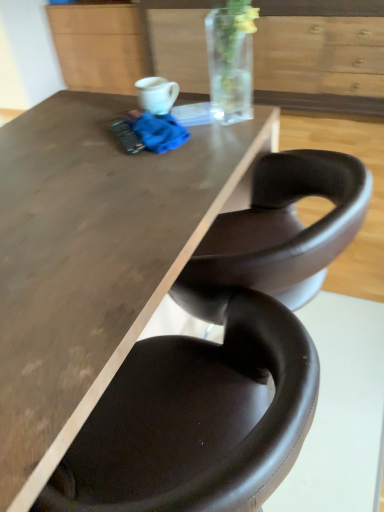
Describe the element at coordinates (157, 94) in the screenshot. I see `white glossy mug at upper center` at that location.

Image resolution: width=384 pixels, height=512 pixels. What do you see at coordinates (91, 260) in the screenshot?
I see `matte brown table at center` at bounding box center [91, 260].

Where is `wooden drawer at upper center`? Image resolution: width=384 pixels, height=512 pixels. wooden drawer at upper center is located at coordinates (320, 55).

How different are the orientations of matte wood cabinet at upper center and wooden drawer at upper center in degrees?

matte wood cabinet at upper center and wooden drawer at upper center are facing 1.2 degrees away from each other.

You are a GUI agent. You are given a task and a screenshot of the screen. Output one action in this format:
    pyautogui.click(x=<x>, y=<y>)
    Task: Click on the drawer below the matte wood cabinet at upper center (from the image's perspective)
    
    Given the screenshot: What is the action you would take?
    pyautogui.click(x=320, y=55)

From a real-world perspective, relative to wooden drawer at upper center, is matte wood cabinet at upper center vertically above or below?

matte wood cabinet at upper center is below wooden drawer at upper center.

Does matte wood cabinet at upper center have a smaller size compared to wooden drawer at upper center?

Yes.

Does brown leather chair at lower center touch matte wood cabinet at upper center?

brown leather chair at lower center and matte wood cabinet at upper center are not in contact.

Is brown leather chair at lower center surrounding matte wood cabinet at upper center?

No, matte wood cabinet at upper center is located outside of brown leather chair at lower center.

Is brown leather chair at lower center facing away from matte wood cabinet at upper center?

No, brown leather chair at lower center's orientation is not away from matte wood cabinet at upper center.

Is the depth of brown leather chair at lower center greater than that of matte wood cabinet at upper center?

No, brown leather chair at lower center is in front of matte wood cabinet at upper center.

Does white glossy mug at upper center have a lesser height compared to matte brown table at center?

Yes, white glossy mug at upper center is shorter than matte brown table at center.

Considering the positions of points (168, 100) and (14, 411), is point (168, 100) closer to camera compared to point (14, 411)?

No, (168, 100) is further to viewer.

How much distance is there between white glossy mug at upper center and matte brown table at center?

A distance of 15.83 inches exists between white glossy mug at upper center and matte brown table at center.

Visually, is white glossy mug at upper center positioned to the left or to the right of wooden drawer at upper center?

In the image, white glossy mug at upper center appears on the left side of wooden drawer at upper center.

Can you confirm if white glossy mug at upper center is bigger than wooden drawer at upper center?

Actually, white glossy mug at upper center might be smaller than wooden drawer at upper center.

Is the depth of white glossy mug at upper center greater than that of wooden drawer at upper center?

No, white glossy mug at upper center is in front of wooden drawer at upper center.

From a real-world perspective, is white glossy mug at upper center above or below wooden drawer at upper center?

Clearly, from a real-world perspective, white glossy mug at upper center is above wooden drawer at upper center.

Considering the positions of points (279, 317) and (166, 108), is point (279, 317) farther from camera compared to point (166, 108)?

No, it is in front of (166, 108).

Is brown leather chair at lower center inside or outside of white glossy mug at upper center?

brown leather chair at lower center is outside white glossy mug at upper center.

How far apart are brown leather chair at lower center and white glossy mug at upper center?

31.09 inches.

Which is in front, brown leather chair at lower center or white glossy mug at upper center?

brown leather chair at lower center is in front.

What are the coordinates of `chair below the matte brown table at center (from the image's perspective)` in the screenshot? It's located at (196, 418).

From a real-world perspective, which is physically above, brown leather chair at lower center or matte brown table at center?

From a 3D spatial view, matte brown table at center is above.

Considering the sizes of brown leather chair at lower center and matte brown table at center in the image, is brown leather chair at lower center bigger or smaller than matte brown table at center?

Considering their sizes, brown leather chair at lower center takes up less space than matte brown table at center.

From a real-world perspective, between brown leather chair at lower center and wooden drawer at upper center, who is vertically higher?

brown leather chair at lower center.

Which is more distant, (317, 364) or (336, 82)?

The point (336, 82) is behind.

Who is taller, brown leather chair at lower center or wooden drawer at upper center?

With more height is brown leather chair at lower center.

Is there a large distance between brown leather chair at lower center and wooden drawer at upper center?

Yes, brown leather chair at lower center is far from wooden drawer at upper center.

Where is `cabinetry on the left of wooden drawer at upper center`? cabinetry on the left of wooden drawer at upper center is located at coordinates (99, 46).

In the image, there is a brown leather chair at lower center. Identify the location of cabinetry above it (from the image's perspective). Image resolution: width=384 pixels, height=512 pixels. (99, 46).

From the image, which object appears to be nearer to matte brown table at center, brown leather chair at lower center or matte wood cabinet at upper center?

Based on the image, brown leather chair at lower center appears to be nearer to matte brown table at center.

Based on their spatial positions, is wooden drawer at upper center or brown leather chair at lower center closer to white glossy mug at upper center?

brown leather chair at lower center is closer to white glossy mug at upper center.

Based on their spatial positions, is wooden drawer at upper center or brown leather chair at lower center further from matte wood cabinet at upper center?

Among the two, brown leather chair at lower center is located further to matte wood cabinet at upper center.

From the picture: Based on their spatial positions, is matte wood cabinet at upper center or wooden drawer at upper center further from matte brown table at center?

Based on the image, matte wood cabinet at upper center appears to be further to matte brown table at center.

Based on their spatial positions, is brown leather chair at lower center or white glossy mug at upper center further from matte brown table at center?

white glossy mug at upper center lies further to matte brown table at center than the other object.

Consider the image. Considering their positions, is white glossy mug at upper center positioned closer to wooden drawer at upper center than matte wood cabinet at upper center?

matte wood cabinet at upper center lies closer to wooden drawer at upper center than the other object.

Which object lies nearer to the anchor point brown leather chair at lower center, matte brown table at center or white glossy mug at upper center?

matte brown table at center is positioned closer to the anchor brown leather chair at lower center.

Consider the image. Looking at the image, which one is located closer to brown leather chair at lower center, matte wood cabinet at upper center or white glossy mug at upper center?

Among the two, white glossy mug at upper center is located nearer to brown leather chair at lower center.

Find the location of `drawer between matte brown table at center and matte wood cabinet at upper center along the z-axis`. drawer between matte brown table at center and matte wood cabinet at upper center along the z-axis is located at coordinates (320, 55).

Locate an element on the screen. The height and width of the screenshot is (512, 384). table between brown leather chair at lower center and matte wood cabinet at upper center in the front-back direction is located at coordinates (91, 260).

Locate an element on the screen. mug between matte brown table at center and wooden drawer at upper center along the z-axis is located at coordinates (157, 94).

I want to click on table between white glossy mug at upper center and brown leather chair at lower center in the up-down direction, so click(x=91, y=260).